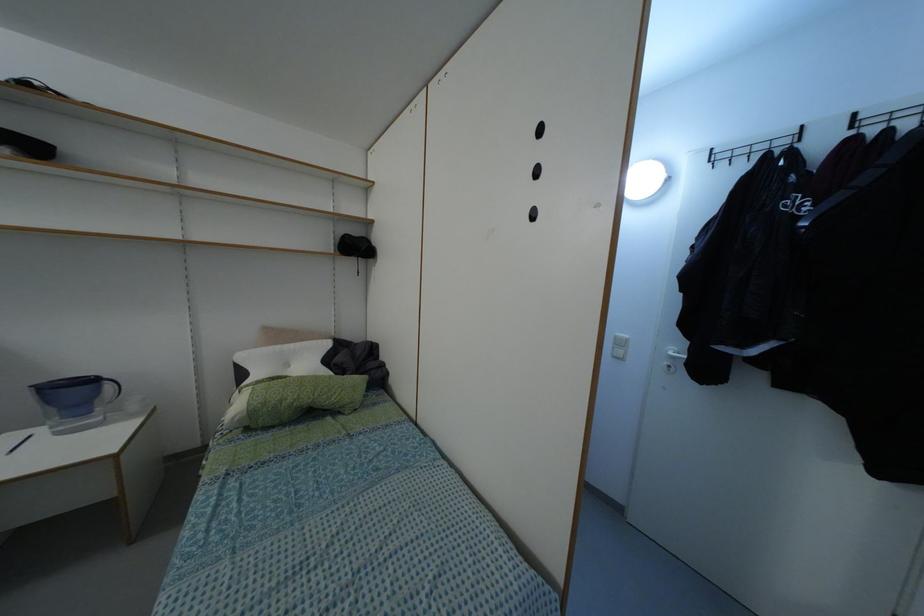
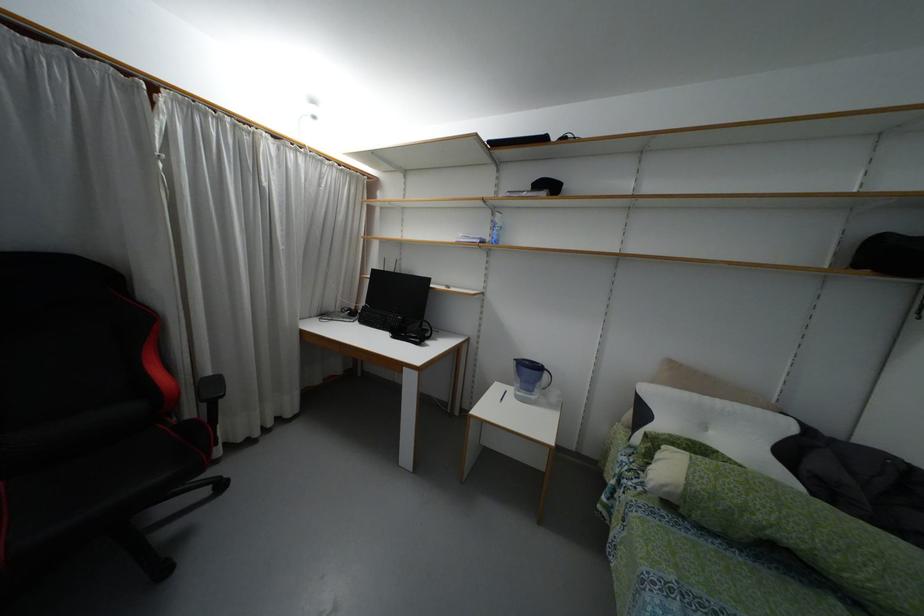
Locate, in the second image, the point that corresponds to point (276, 346) in the first image.

(695, 395)